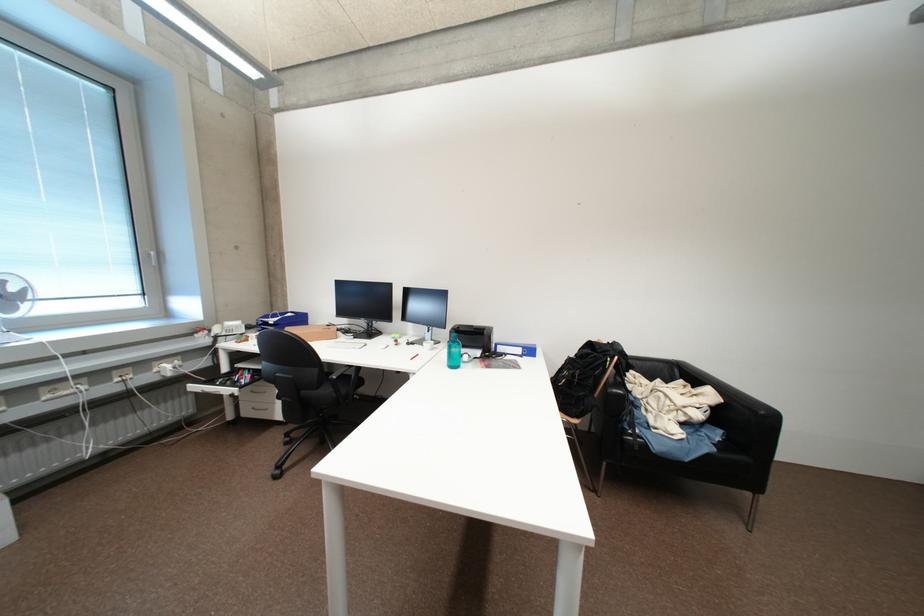
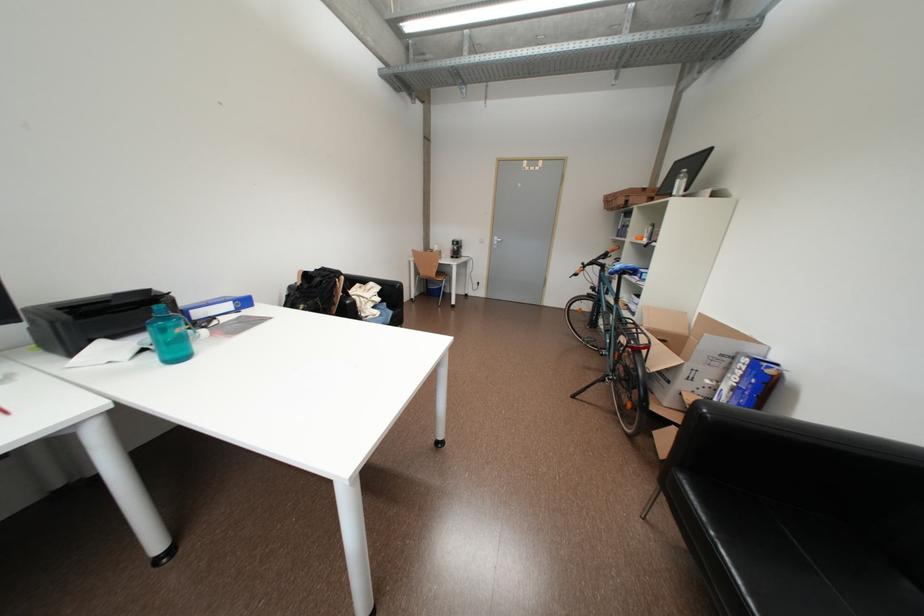
Locate, in the second image, the point that corresponds to pixel 462 368 in the first image.

(186, 360)